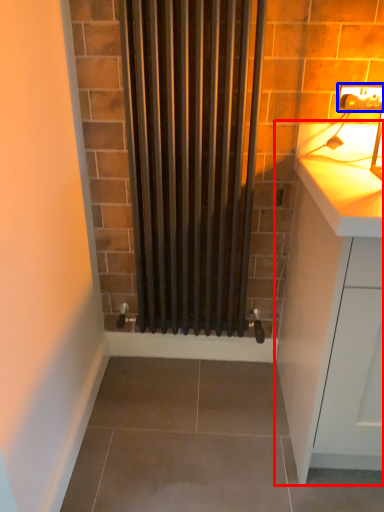
Question: Among these objects, which one is farthest to the camera, cabinetry (highlighted by a red box) or electric outlet (highlighted by a blue box)?

Choices:
 (A) cabinetry
 (B) electric outlet

Answer: (B)